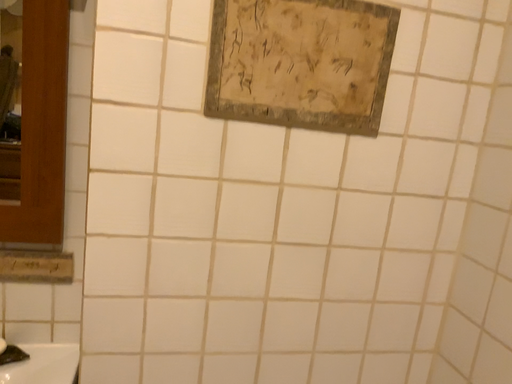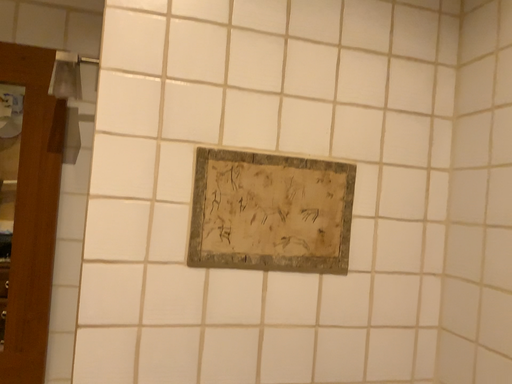
Question: Which way did the camera rotate in the video?

Choices:
 (A) rotated downward
 (B) rotated upward

Answer: (B)